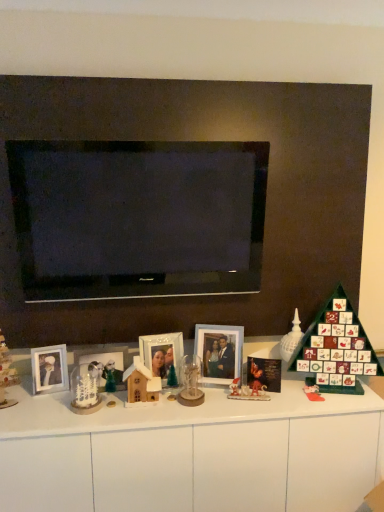
Where is `vacant space in front of white glossy picture frame at center, the 2th picture frame positioned from the left`? This screenshot has width=384, height=512. vacant space in front of white glossy picture frame at center, the 2th picture frame positioned from the left is located at coordinates (161, 415).